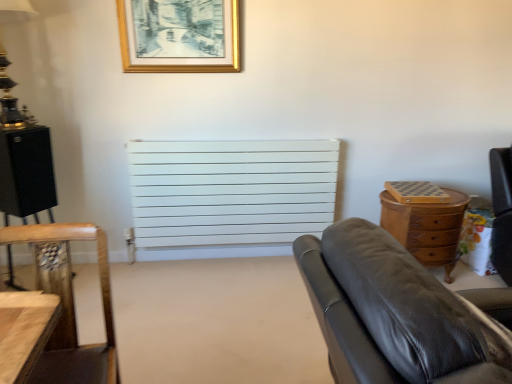
The image size is (512, 384). I want to click on free point below gold/golden frame at upper center (from a real-world perspective), so click(x=186, y=132).